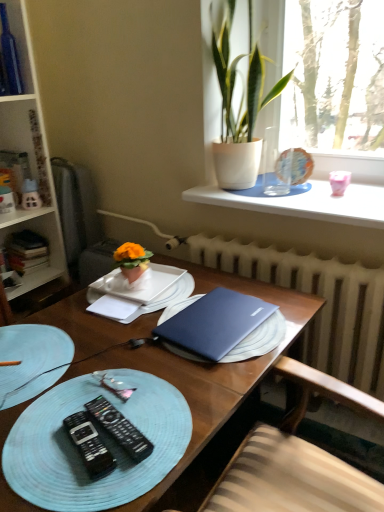
In order to click on vacant space that is in between black plastic remote control at lower left, positioned as the 1th remote control in left-to-right order, and blue woven placemat at lower left, arranged as the second tableware when viewed from the top in this screenshot , I will do `click(60, 416)`.